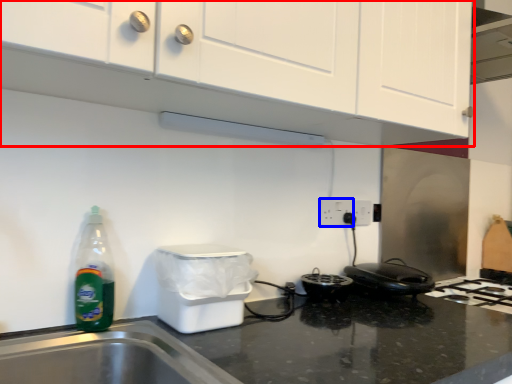
Question: Which object appears closest to the camera in this image, cabinetry (highlighted by a red box) or electric outlet (highlighted by a blue box)?

Choices:
 (A) cabinetry
 (B) electric outlet

Answer: (A)